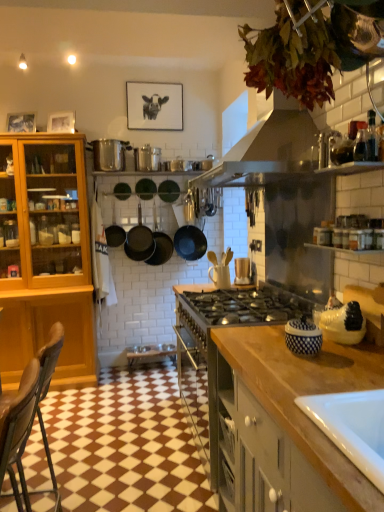
Question: Is matte wooden picture frame at upper left, the first picture frame when ordered from left to right, at the back of metallic silver pot at upper center, the second appliance from the back?

Choices:
 (A) no
 (B) yes

Answer: (A)

Question: Would you consider metallic silver pot at upper center, the second appliance from the back, to be distant from matte wooden picture frame at upper left, the first picture frame when ordered from left to right?

Choices:
 (A) no
 (B) yes

Answer: (A)

Question: Considering the relative sizes of metallic silver pot at upper center, the 4th appliance in the front-to-back sequence, and matte wooden picture frame at upper left, which is counted as the 1th picture frame, starting from the front, in the image provided, is metallic silver pot at upper center, the 4th appliance in the front-to-back sequence, thinner than matte wooden picture frame at upper left, which is counted as the 1th picture frame, starting from the front,?

Choices:
 (A) yes
 (B) no

Answer: (B)

Question: Does metallic silver pot at upper center, the second appliance from the back, appear on the left side of matte wooden picture frame at upper left, which is the 2th picture frame in back-to-front order?

Choices:
 (A) yes
 (B) no

Answer: (B)

Question: Can you confirm if metallic silver pot at upper center, the second appliance from the back, is shorter than matte wooden picture frame at upper left, which is counted as the 1th picture frame, starting from the front?

Choices:
 (A) yes
 (B) no

Answer: (B)

Question: Is point (31, 121) closer or farther from the camera than point (327, 315)?

Choices:
 (A) farther
 (B) closer

Answer: (A)

Question: Considering the positions of matte wooden picture frame at upper left, the first picture frame when ordered from left to right, and matte white ceramic jar at right, the 4th appliance in the back-to-front sequence, in the image, is matte wooden picture frame at upper left, the first picture frame when ordered from left to right, wider or thinner than matte white ceramic jar at right, the 4th appliance in the back-to-front sequence,?

Choices:
 (A) thin
 (B) wide

Answer: (A)

Question: From a real-world perspective, relative to matte white ceramic jar at right, the 4th appliance in the back-to-front sequence, is matte wooden picture frame at upper left, which is counted as the 1th picture frame, starting from the front, vertically above or below?

Choices:
 (A) below
 (B) above

Answer: (B)

Question: Is matte wooden picture frame at upper left, the first picture frame when ordered from left to right, in front of or behind matte white ceramic jar at right, positioned as the 1th appliance in right-to-left order, in the image?

Choices:
 (A) behind
 (B) front

Answer: (A)

Question: Considering the positions of point (203, 244) and point (165, 190), is point (203, 244) closer or farther from the camera than point (165, 190)?

Choices:
 (A) farther
 (B) closer

Answer: (B)

Question: Considering the positions of black matte pan at center, which is the 3th kitchen appliance from left to right, and black matte frying pan at center, the second frying pan positioned from the left, in the image, is black matte pan at center, which is the 3th kitchen appliance from left to right, bigger or smaller than black matte frying pan at center, the second frying pan positioned from the left,?

Choices:
 (A) big
 (B) small

Answer: (A)

Question: From the image's perspective, is black matte pan at center, which is the 3th kitchen appliance from left to right, positioned above or below black matte frying pan at center, the second frying pan positioned from the left?

Choices:
 (A) below
 (B) above

Answer: (A)

Question: From a real-world perspective, is black matte pan at center, which is counted as the 1th kitchen appliance, starting from the right, positioned above or below black matte frying pan at center, the second frying pan positioned from the left?

Choices:
 (A) above
 (B) below

Answer: (B)

Question: From their relative heights in the image, would you say matte brown wooden spoon holder at center, which is the third appliance from right to left, is taller or shorter than brown leather chair at lower left?

Choices:
 (A) tall
 (B) short

Answer: (B)

Question: Which is correct: matte brown wooden spoon holder at center, which is counted as the third appliance, starting from the front, is inside brown leather chair at lower left, or outside of it?

Choices:
 (A) outside
 (B) inside

Answer: (A)